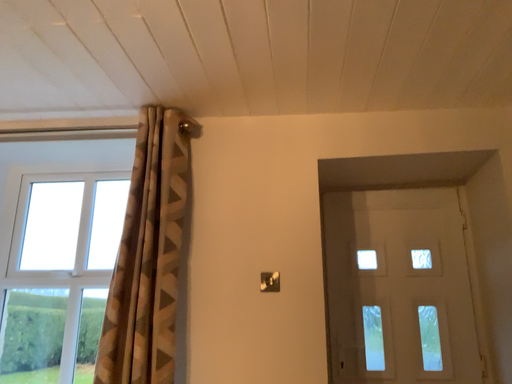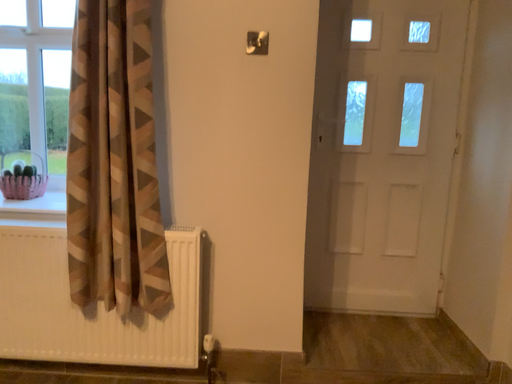
Question: How did the camera likely rotate when shooting the video?

Choices:
 (A) rotated downward
 (B) rotated upward

Answer: (A)